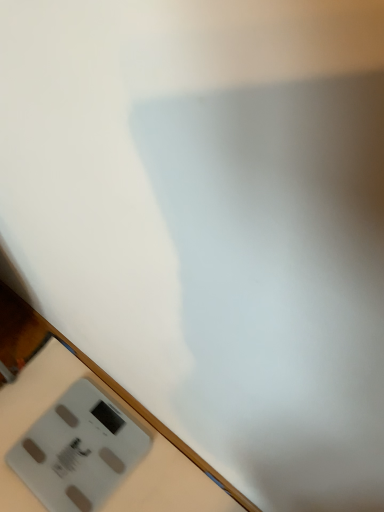
Question: From the image's perspective, is gray plastic scale at bottom left on white plastic scale at lower left?

Choices:
 (A) yes
 (B) no

Answer: (A)

Question: Is gray plastic scale at bottom left to the right of white plastic scale at lower left from the viewer's perspective?

Choices:
 (A) no
 (B) yes

Answer: (A)

Question: Can you confirm if gray plastic scale at bottom left is taller than white plastic scale at lower left?

Choices:
 (A) no
 (B) yes

Answer: (A)

Question: Can you confirm if gray plastic scale at bottom left is wider than white plastic scale at lower left?

Choices:
 (A) yes
 (B) no

Answer: (B)

Question: From a real-world perspective, is gray plastic scale at bottom left located beneath white plastic scale at lower left?

Choices:
 (A) no
 (B) yes

Answer: (B)

Question: Can you confirm if gray plastic scale at bottom left is bigger than white plastic scale at lower left?

Choices:
 (A) no
 (B) yes

Answer: (A)

Question: Considering the relative sizes of white plastic scale at lower left and gray plastic scale at bottom left in the image provided, is white plastic scale at lower left smaller than gray plastic scale at bottom left?

Choices:
 (A) no
 (B) yes

Answer: (A)

Question: Is white plastic scale at lower left facing away from gray plastic scale at bottom left?

Choices:
 (A) no
 (B) yes

Answer: (B)

Question: Is gray plastic scale at bottom left located within white plastic scale at lower left?

Choices:
 (A) yes
 (B) no

Answer: (A)

Question: Does white plastic scale at lower left have a larger size compared to gray plastic scale at bottom left?

Choices:
 (A) yes
 (B) no

Answer: (A)

Question: Can we say white plastic scale at lower left lies outside gray plastic scale at bottom left?

Choices:
 (A) no
 (B) yes

Answer: (B)

Question: Are white plastic scale at lower left and gray plastic scale at bottom left beside each other?

Choices:
 (A) yes
 (B) no

Answer: (A)

Question: Does point (33, 375) appear closer or farther from the camera than point (86, 394)?

Choices:
 (A) closer
 (B) farther

Answer: (B)